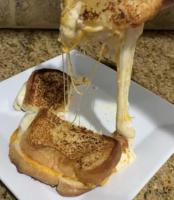
In order to click on table in this screenshot , I will do `click(151, 56)`.